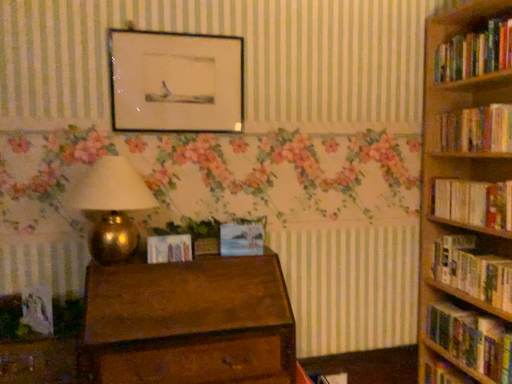
Describe the element at coordinates (112, 207) in the screenshot. I see `gold metallic table lamp at left` at that location.

Identify the location of gold metallic table lamp at left. Image resolution: width=512 pixels, height=384 pixels. (112, 207).

Locate an element on the screen. The width and height of the screenshot is (512, 384). hardcover books at right, the 5th book in the bottom-to-top sequence is located at coordinates (475, 53).

Consider the image. From the image's perspective, which is below, hardcover books at right, the first book ordered from the bottom, or matte paper photo frame at center, which is counted as the 1th paperback book, starting from the left?

hardcover books at right, the first book ordered from the bottom.

Considering the sizes of objects hardcover books at right, the first book ordered from the bottom, and matte paper photo frame at center, which is counted as the 1th paperback book, starting from the left, in the image provided, who is wider, hardcover books at right, the first book ordered from the bottom, or matte paper photo frame at center, which is counted as the 1th paperback book, starting from the left,?

Wider between the two is hardcover books at right, the first book ordered from the bottom.

Would you consider hardcover books at right, which is the 5th book in top-to-bottom order, to be distant from matte paper photo frame at center, marked as the second paperback book in a right-to-left arrangement?

Yes, hardcover books at right, which is the 5th book in top-to-bottom order, and matte paper photo frame at center, marked as the second paperback book in a right-to-left arrangement, are quite far apart.

Is hardcover books at right, which is the 5th book in top-to-bottom order, to the right of matte paper photo frame at center, marked as the second paperback book in a right-to-left arrangement, from the viewer's perspective?

Indeed, hardcover books at right, which is the 5th book in top-to-bottom order, is positioned on the right side of matte paper photo frame at center, marked as the second paperback book in a right-to-left arrangement.

Does hardcover book at right, which is the third book in bottom-to-top order, have a larger size compared to wooden chest of drawers at center?

Incorrect, hardcover book at right, which is the third book in bottom-to-top order, is not larger than wooden chest of drawers at center.

Does hardcover book at right, positioned as the 3th book in top-to-bottom order, appear on the left side of wooden chest of drawers at center?

In fact, hardcover book at right, positioned as the 3th book in top-to-bottom order, is to the right of wooden chest of drawers at center.

Considering the positions of objects hardcover book at right, which is the third book in bottom-to-top order, and wooden chest of drawers at center in the image provided, who is in front, hardcover book at right, which is the third book in bottom-to-top order, or wooden chest of drawers at center?

wooden chest of drawers at center is in front.

From a real-world perspective, which object rests below the other?

wooden chest of drawers at center, from a real-world perspective.

Considering the relative sizes of hardcover books at right, the 1th book from the top, and wooden bookshelf at right in the image provided, is hardcover books at right, the 1th book from the top, shorter than wooden bookshelf at right?

Incorrect, the height of hardcover books at right, the 1th book from the top, does not fall short of that of wooden bookshelf at right.

From the image's perspective, is hardcover books at right, the 5th book in the bottom-to-top sequence, under wooden bookshelf at right?

No.

Considering the positions of objects hardcover books at right, the 1th book from the top, and wooden bookshelf at right in the image provided, who is more to the right, hardcover books at right, the 1th book from the top, or wooden bookshelf at right?

Positioned to the right is wooden bookshelf at right.

Is hardcover books at right, the first book ordered from the bottom, oriented away from hardcover book at right, positioned as the 3th book in top-to-bottom order?

No, hardcover books at right, the first book ordered from the bottom, is not facing away from hardcover book at right, positioned as the 3th book in top-to-bottom order.

From a real-world perspective, is hardcover books at right, the first book ordered from the bottom, positioned under hardcover book at right, positioned as the 3th book in top-to-bottom order, based on gravity?

Yes, from a real-world perspective, hardcover books at right, the first book ordered from the bottom, is below hardcover book at right, positioned as the 3th book in top-to-bottom order.

From the image's perspective, is hardcover books at right, the first book ordered from the bottom, under hardcover book at right, positioned as the 3th book in top-to-bottom order?

Indeed, from the image's perspective, hardcover books at right, the first book ordered from the bottom, is shown beneath hardcover book at right, positioned as the 3th book in top-to-bottom order.

How different are the orientations of hardcover books at right, the first book ordered from the bottom, and hardcover book at right, which is the third book in bottom-to-top order, in degrees?

hardcover books at right, the first book ordered from the bottom, and hardcover book at right, which is the third book in bottom-to-top order, are facing 0.000352 degrees away from each other.

From the image's perspective, is wooden bookshelf at right over matte paper photo frame at center, which is counted as the 1th paperback book, starting from the left?

No, from the image's perspective, wooden bookshelf at right is not above matte paper photo frame at center, which is counted as the 1th paperback book, starting from the left.

Does wooden bookshelf at right turn towards matte paper photo frame at center, marked as the second paperback book in a right-to-left arrangement?

No, wooden bookshelf at right is not turned towards matte paper photo frame at center, marked as the second paperback book in a right-to-left arrangement.

Which is in front, point (451, 358) or point (190, 250)?

Point (190, 250)

How many degrees apart are the facing directions of wooden bookshelf at right and matte paper photo frame at center, marked as the second paperback book in a right-to-left arrangement?

The angle between the facing direction of wooden bookshelf at right and the facing direction of matte paper photo frame at center, marked as the second paperback book in a right-to-left arrangement, is 86.5 degrees.

In the scene shown: Is matte black picture frame at upper center directly adjacent to gold metallic table lamp at left?

matte black picture frame at upper center is not next to gold metallic table lamp at left, and they're not touching.

Consider the image. How far apart are matte black picture frame at upper center and gold metallic table lamp at left?

matte black picture frame at upper center and gold metallic table lamp at left are 17.47 inches apart from each other.

Is matte black picture frame at upper center oriented away from gold metallic table lamp at left?

No, gold metallic table lamp at left is not at the back of matte black picture frame at upper center.

Looking at this image, from the image's perspective, would you say matte black picture frame at upper center is positioned over gold metallic table lamp at left?

Yes, from the image's perspective, matte black picture frame at upper center is on top of gold metallic table lamp at left.

Would you say pastel blue canvas painting at center, which appears as the 2th paperback book when viewed from the left, is to the left or to the right of wooden drawer at lower left in the picture?

From the image, it's evident that pastel blue canvas painting at center, which appears as the 2th paperback book when viewed from the left, is to the right of wooden drawer at lower left.

How many degrees apart are the facing directions of pastel blue canvas painting at center, which is the first paperback book in right-to-left order, and wooden drawer at lower left?

The angular difference between pastel blue canvas painting at center, which is the first paperback book in right-to-left order, and wooden drawer at lower left is 16.4 degrees.

Is wooden drawer at lower left located within pastel blue canvas painting at center, which is the first paperback book in right-to-left order?

No.

Is pastel blue canvas painting at center, which is the first paperback book in right-to-left order, smaller than wooden drawer at lower left?

Yes, pastel blue canvas painting at center, which is the first paperback book in right-to-left order, is smaller than wooden drawer at lower left.

Locate an element on the screen. paperback book that is the 1st object above the hardcover books at right, the first book ordered from the bottom (from a real-world perspective) is located at coordinates (169, 248).

Locate an element on the screen. The height and width of the screenshot is (384, 512). book that is the 2nd one when counting upward from the wooden chest of drawers at center (from the image's perspective) is located at coordinates (474, 202).

Looking at the image, which one is located closer to hardcover books at right, the 5th book in the bottom-to-top sequence, hardcover book at right, marked as the 4th book in a top-to-bottom arrangement, or wooden bookshelf at right?

The object closer to hardcover books at right, the 5th book in the bottom-to-top sequence, is hardcover book at right, marked as the 4th book in a top-to-bottom arrangement.

Looking at this image, which object lies nearer to the anchor point gold metallic table lamp at left, hardcover book at right, marked as the 4th book in a top-to-bottom arrangement, or wooden drawer at lower left?

wooden drawer at lower left lies closer to gold metallic table lamp at left than the other object.

Which object lies nearer to the anchor point wooden bookshelf at right, matte black picture frame at upper center or hardcover book at right, marked as the 4th book in a top-to-bottom arrangement?

hardcover book at right, marked as the 4th book in a top-to-bottom arrangement, is positioned closer to the anchor wooden bookshelf at right.

From the image, which object appears to be nearer to gold metallic table lamp at left, pastel blue canvas painting at center, which is the first paperback book in right-to-left order, or hardcover books at right, the 1th book from the top?

Among the two, pastel blue canvas painting at center, which is the first paperback book in right-to-left order, is located nearer to gold metallic table lamp at left.

From the picture: From the image, which object appears to be nearer to gold metallic table lamp at left, wooden bookshelf at right or wooden drawer at lower left?

wooden drawer at lower left is closer to gold metallic table lamp at left.

From the image, which object appears to be nearer to pastel blue canvas painting at center, which appears as the 2th paperback book when viewed from the left, wooden chest of drawers at center or gold metallic table lamp at left?

wooden chest of drawers at center is positioned closer to the anchor pastel blue canvas painting at center, which appears as the 2th paperback book when viewed from the left.

Consider the image. Considering their positions, is gold metallic table lamp at left positioned further to matte paper photo frame at center, marked as the second paperback book in a right-to-left arrangement, than hardcover books at right, the first book ordered from the bottom?

Based on the image, hardcover books at right, the first book ordered from the bottom, appears to be further to matte paper photo frame at center, marked as the second paperback book in a right-to-left arrangement.

Looking at this image, based on their spatial positions, is matte paper photo frame at center, marked as the second paperback book in a right-to-left arrangement, or hardcover books at right, which is the 5th book in top-to-bottom order, further from hardcover books at right, the 1th book from the top?

matte paper photo frame at center, marked as the second paperback book in a right-to-left arrangement, is positioned further to the anchor hardcover books at right, the 1th book from the top.

Identify the location of chest of drawers between wooden drawer at lower left and hardcover book at right, marked as the 4th book in a top-to-bottom arrangement, from left to right. (190, 322).

Locate an element on the screen. This screenshot has width=512, height=384. paperback book between matte black picture frame at upper center and matte paper photo frame at center, which is counted as the 1th paperback book, starting from the left, in the up-down direction is located at coordinates (241, 239).

The height and width of the screenshot is (384, 512). I want to click on chest of drawers between matte paper photo frame at center, which is counted as the 1th paperback book, starting from the left, and wooden bookshelf at right, so click(190, 322).

Locate an element on the screen. chest of drawers between gold metallic table lamp at left and hardcover book at right, which appears as the second book when ordered from the bottom, from left to right is located at coordinates point(190,322).